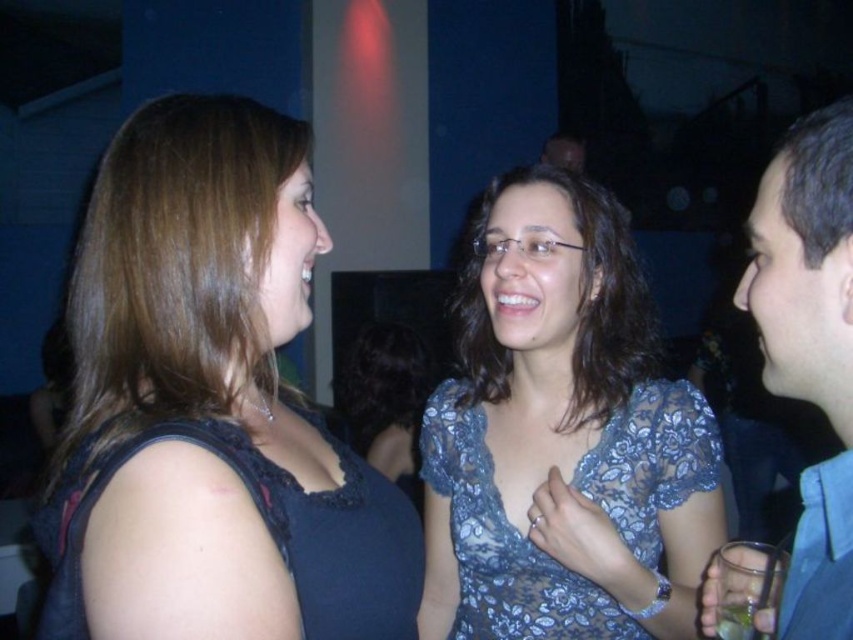
You are at a party and want to take a photo of both the blue fabric shirt at right and the dark blue lace dress at left. Which one should you focus on to ensure both are in the frame?

You should focus on the blue fabric shirt at right because it is in front of the dark blue lace dress at left, so positioning the camera to include the foreground object will naturally include the background one as well.

You are at a party and want to approach the dark blue lace dress at left and the blue fabric shirt at right. Which one is closer to your current position if you are standing in the center of the room?

The dark blue lace dress at left is closer to your current position because it is on the left side, while the blue fabric shirt at right is positioned to the right of it.

What is the color of the fabric at the point with coordinates [809,349]?

The blue fabric shirt at right is located at point [809,349], so the color is blue.